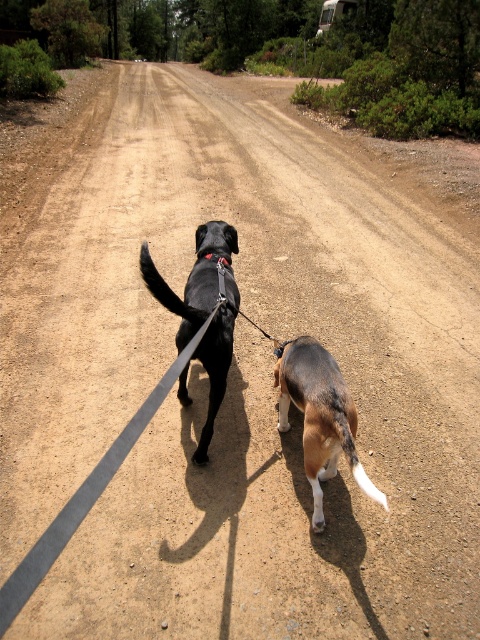
You are a photographer trying to capture both dogs in a single frame. Given that the shiny black dog at center is larger, will the brown and white fur at center appear smaller in the photo?

Yes, the brown and white fur at center will appear smaller in the photo because it occupies less space than the shiny black dog at center.